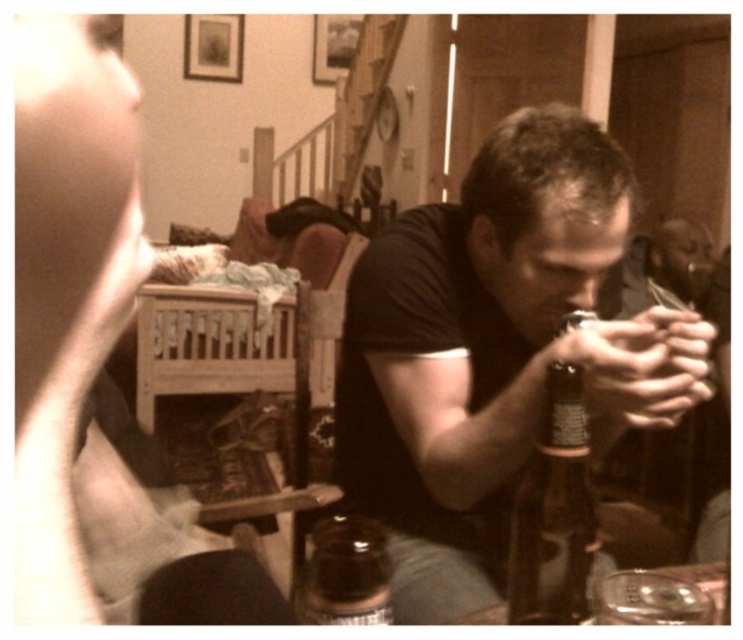
You are a photographer trying to capture a closeup of the translucent glass bottle at lower center without including the matte black shirt at center in the frame. Given their sizes, is this possible?

The matte black shirt at center has a larger size compared to the translucent glass bottle at lower center, so it might be challenging to frame the bottle without including the shirt if they are positioned close together. Adjusting the camera angle or moving closer to the bottle could help isolate it.

You are a photographer who wants to take a picture of the brown glass bottle at center. You have a matte black camera at center. Where should you position the camera relative to the bottle to capture it in the frame?

The matte black camera at center is located above the brown glass bottle at center, so you should position the camera above the bottle to capture it in the frame.

You are setting up a photography setup in the living room and have both the matte black camera at center and the brown glass bottle at center in front of you. Which object is wider?

The matte black camera at center is wider than the brown glass bottle at center.